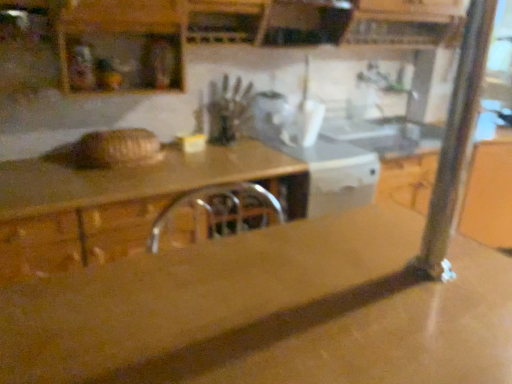
In order to face white glossy microwave at center, should I rotate leftwards or rightwards?

It's best to rotate right around 2.606 degrees.

This screenshot has height=384, width=512. What are the coordinates of `white glossy microwave at center` in the screenshot? It's located at (271, 113).

Image resolution: width=512 pixels, height=384 pixels. What do you see at coordinates (271, 113) in the screenshot?
I see `white glossy microwave at center` at bounding box center [271, 113].

Measure the distance between white glossy microwave at center and camera.

white glossy microwave at center and camera are 7.81 feet apart from each other.

Identify the location of brown polished wood countertop at center. This screenshot has width=512, height=384. (270, 312).

Image resolution: width=512 pixels, height=384 pixels. Describe the element at coordinates (270, 312) in the screenshot. I see `brown polished wood countertop at center` at that location.

Measure the distance between point (375, 380) and camera.

Point (375, 380) is 23.62 inches away from camera.

Where is `white glossy microwave at center`? Image resolution: width=512 pixels, height=384 pixels. white glossy microwave at center is located at coordinates (271, 113).

In the image, is white glossy microwave at center on the left side or the right side of brown polished wood countertop at center?

white glossy microwave at center is to the right of brown polished wood countertop at center.

Is white glossy microwave at center closer to the viewer compared to brown polished wood countertop at center?

No, it is not.

Is point (285, 108) less distant than point (42, 333)?

No, (285, 108) is behind (42, 333).

From the image's perspective, which one is positioned lower, white glossy microwave at center or brown polished wood countertop at center?

brown polished wood countertop at center, from the image's perspective.

From a real-world perspective, who is located higher, white glossy microwave at center or brown polished wood countertop at center?

In real-world perspective, white glossy microwave at center is above.

In terms of width, does white glossy microwave at center look wider or thinner when compared to brown polished wood countertop at center?

In the image, white glossy microwave at center appears to be more narrow than brown polished wood countertop at center.

Consider the image. Does white glossy microwave at center have a greater height compared to brown polished wood countertop at center?

No.

Is white glossy microwave at center smaller than brown polished wood countertop at center?

Yes.

Would you say brown polished wood countertop at center is part of white glossy microwave at center's contents?

Definitely not — brown polished wood countertop at center is not inside white glossy microwave at center.

In the scene shown: Can you see white glossy microwave at center touching brown polished wood countertop at center?

white glossy microwave at center and brown polished wood countertop at center are clearly separated.

Is white glossy microwave at center facing towards brown polished wood countertop at center?

No, white glossy microwave at center does not turn towards brown polished wood countertop at center.

Image resolution: width=512 pixels, height=384 pixels. In the image, there is a white glossy microwave at center. Identify the location of countertop below it (from the image's perspective). (270, 312).

Can you confirm if brown polished wood countertop at center is positioned to the right of white glossy microwave at center?

No, brown polished wood countertop at center is not to the right of white glossy microwave at center.

Relative to white glossy microwave at center, is brown polished wood countertop at center in front or behind?

brown polished wood countertop at center is in front of white glossy microwave at center.

Considering the points (309, 356) and (277, 134), which point is in front, point (309, 356) or point (277, 134)?

The point (309, 356) is closer.

From the image's perspective, is brown polished wood countertop at center located above or below white glossy microwave at center?

From the image's perspective, brown polished wood countertop at center appears below white glossy microwave at center.

From a real-world perspective, which object stands above the other?

In real-world perspective, white glossy microwave at center is above.

Between brown polished wood countertop at center and white glossy microwave at center, which one has smaller width?

white glossy microwave at center is thinner.

Is brown polished wood countertop at center shorter than white glossy microwave at center?

No.

Is brown polished wood countertop at center bigger or smaller than white glossy microwave at center?

Considering their sizes, brown polished wood countertop at center takes up more space than white glossy microwave at center.

Could white glossy microwave at center be considered to be inside brown polished wood countertop at center?

No, brown polished wood countertop at center does not contain white glossy microwave at center.

Is brown polished wood countertop at center not near white glossy microwave at center?

Result: Yes, brown polished wood countertop at center and white glossy microwave at center are located far from each other.

Could you tell me if brown polished wood countertop at center is facing white glossy microwave at center?

No, brown polished wood countertop at center does not turn towards white glossy microwave at center.

Find the location of a particular element. countertop in front of the white glossy microwave at center is located at coordinates (270, 312).

Identify the location of countertop that is under the white glossy microwave at center (from a real-world perspective). The height and width of the screenshot is (384, 512). (270, 312).

At what (x,y) coordinates should I click in order to perform the action: click on countertop in front of the white glossy microwave at center. Please return your answer as a coordinate pair (x, y). Looking at the image, I should click on (270, 312).